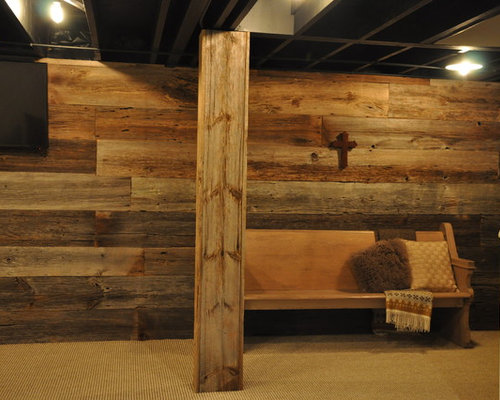
Locate an element on the screen. wood wall is located at coordinates (146, 206).